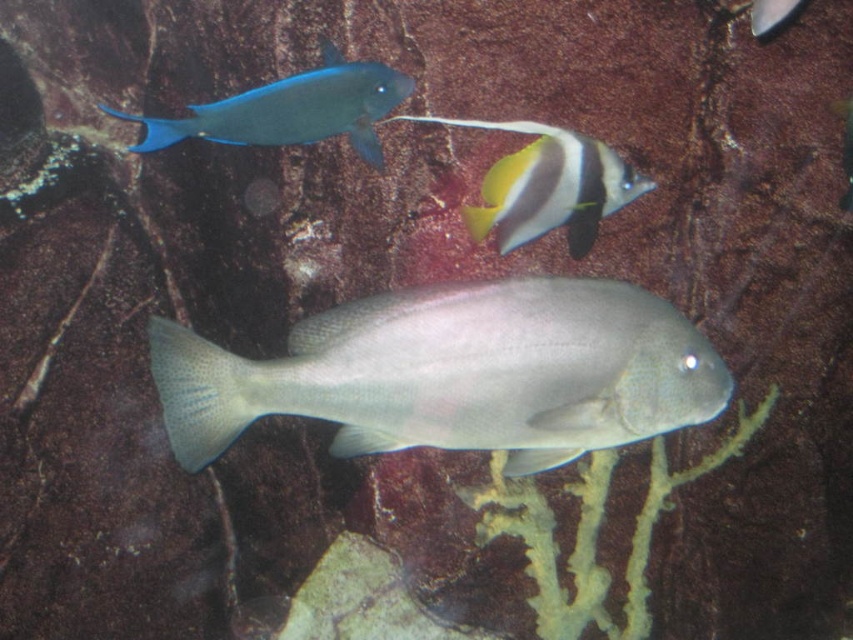
You are a scuba diver observing the underwater scene. You notice two fish, the shiny blue fish at upper left and the shiny silver fish at upper right. Which fish is positioned to the left side of the other?

The shiny blue fish at upper left is positioned to the left of the shiny silver fish at upper right.

You are a marine biologist studying underwater life. You observe a shiny blue fish at upper left and a striped black and white fish at lower right. Based on their positions, which fish is closer to the point marked at coordinates point (x=291, y=109)?

The shiny blue fish at upper left is closer to the point marked at coordinates point (x=291, y=109) because the point corresponds to shiny blue fish at upper left.